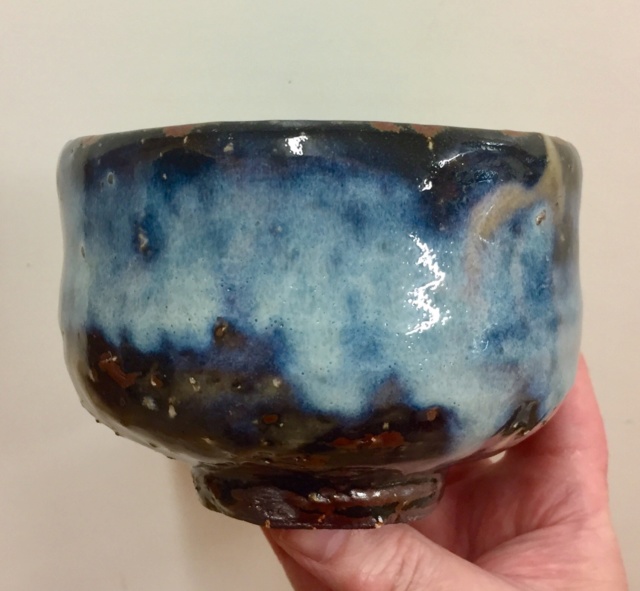
The height and width of the screenshot is (591, 640). I want to click on bottom of bowl, so click(x=292, y=500).